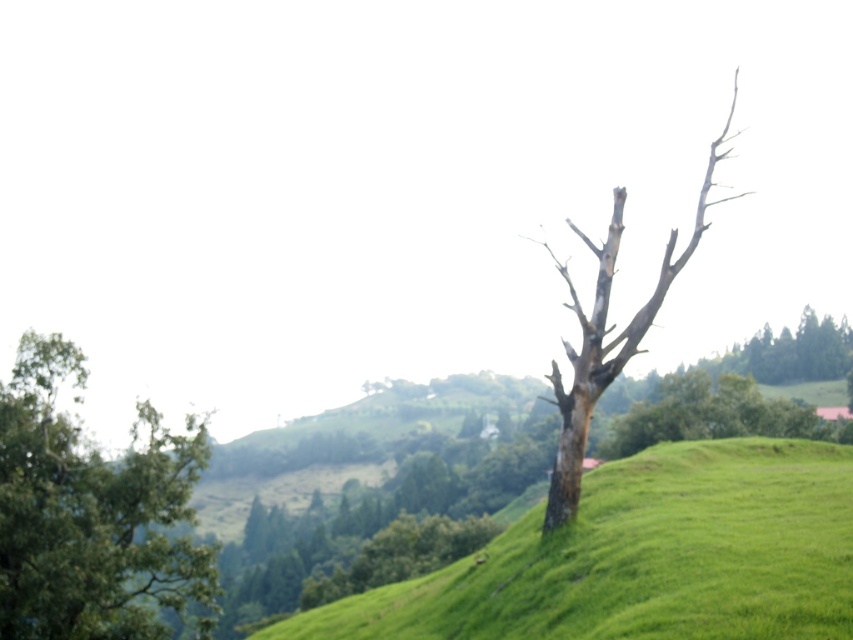
You are an environmental researcher examining the landscape. You notice the green grassy hillside at center and the green leafy tree at left. Which of these two features is positioned lower in the image?

The green grassy hillside at center is located below the green leafy tree at left, so it is positioned lower in the image.